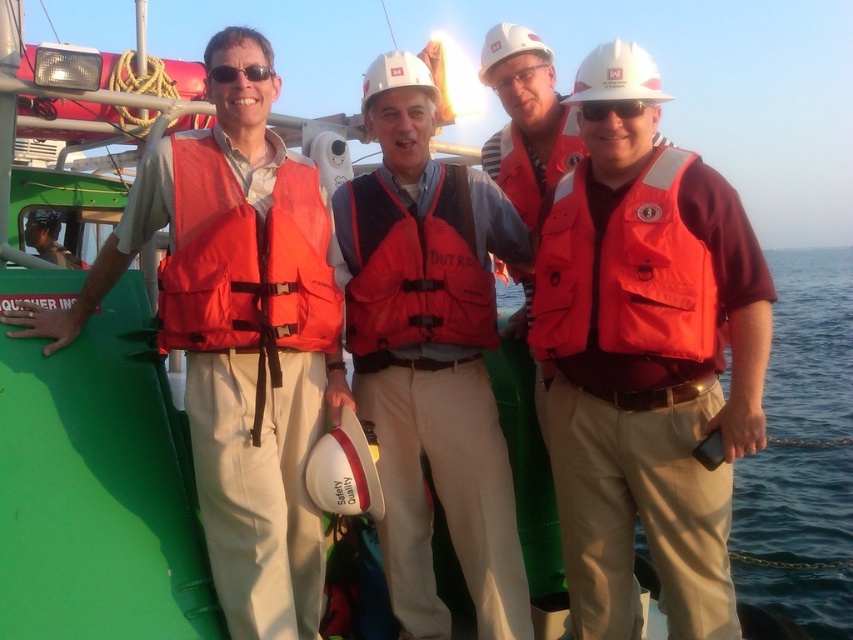
Question: Which object appears closest to the camera in this image?

Choices:
 (A) matte white goggles at center
 (B) orange fabric life vest at center

Answer: (B)

Question: Is matte orange life vest at left wider than matte black helmet at left?

Choices:
 (A) no
 (B) yes

Answer: (B)

Question: Based on their relative distances, which object is nearer to the orange fabric life jacket at left?

Choices:
 (A) sunglasses at center
 (B) matte orange life jacket at right
 (C) matte orange life vest at center
 (D) matte white goggles at center

Answer: (C)

Question: Which object appears closest to the camera in this image?

Choices:
 (A) red matte life jacket at center
 (B) orange fabric life vest at center

Answer: (B)

Question: Can you confirm if orange fabric life vest at center is wider than orange fabric life jacket at left?

Choices:
 (A) no
 (B) yes

Answer: (B)

Question: Is orange fabric life jacket at left wider than matte white goggles at center?

Choices:
 (A) no
 (B) yes

Answer: (B)